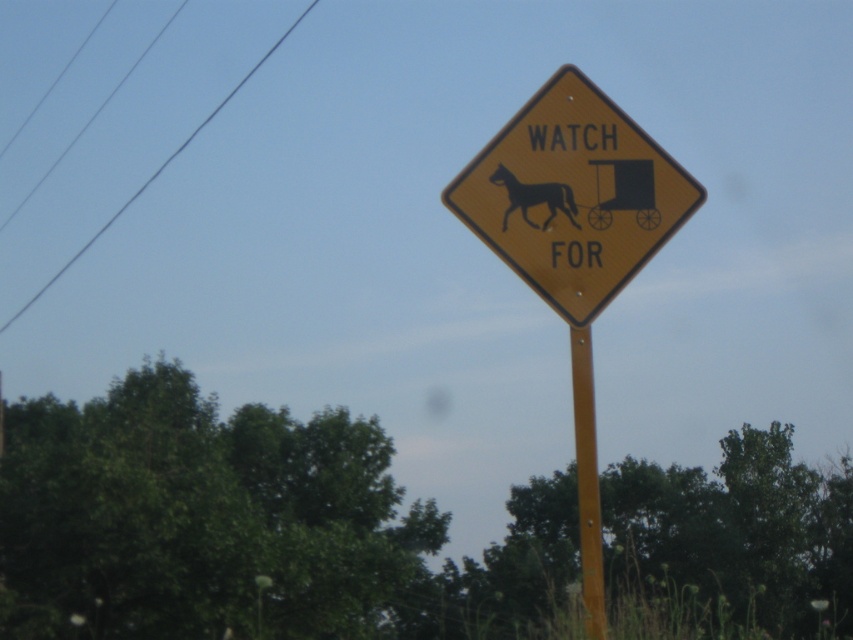
Question: Based on their relative distances, which object is nearer to the yellow diamond-shaped sign at center?

Choices:
 (A) black glossy horse at center
 (B) yellow matte sign at center

Answer: (B)

Question: Can you confirm if yellow matte sign at center is positioned above black wire at upper left?

Choices:
 (A) yes
 (B) no

Answer: (B)

Question: Does yellow diamond-shaped sign at center appear under yellow metallic pole at center?

Choices:
 (A) no
 (B) yes

Answer: (A)

Question: Which object is the farthest from the yellow matte sign at center?

Choices:
 (A) yellow metallic pole at center
 (B) black glossy horse at center
 (C) yellow diamond-shaped sign at center
 (D) black wire at upper left

Answer: (D)

Question: From the image, what is the correct spatial relationship of yellow diamond-shaped sign at center in relation to yellow metallic pole at center?

Choices:
 (A) below
 (B) above

Answer: (B)

Question: Based on their relative distances, which object is nearer to the yellow matte sign at center?

Choices:
 (A) yellow diamond-shaped sign at center
 (B) black glossy horse at center

Answer: (A)